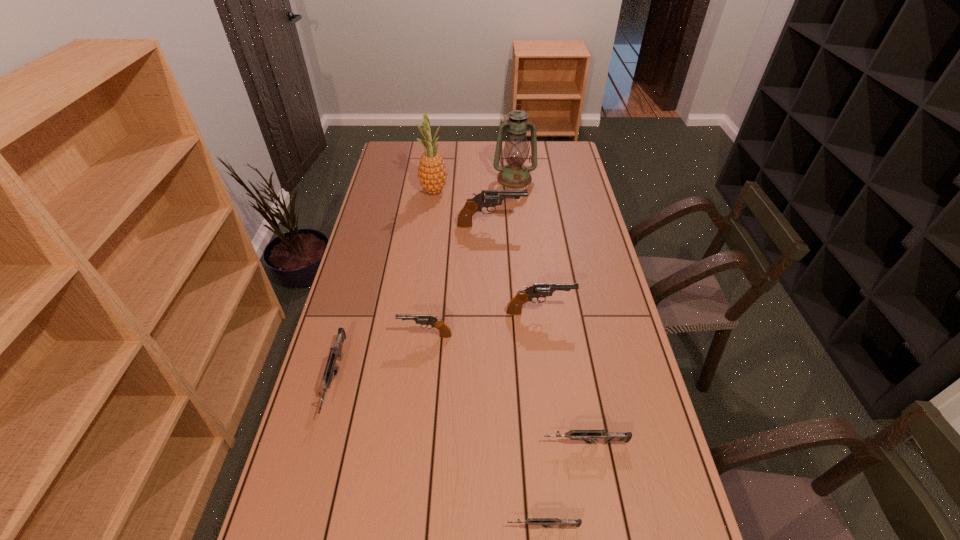
This screenshot has height=540, width=960. I want to click on blank space that satisfies the following two spatial constraints: 1. on the front side of the oil lamp; 2. along the barrel of the sixth nearest object, so click(x=519, y=225).